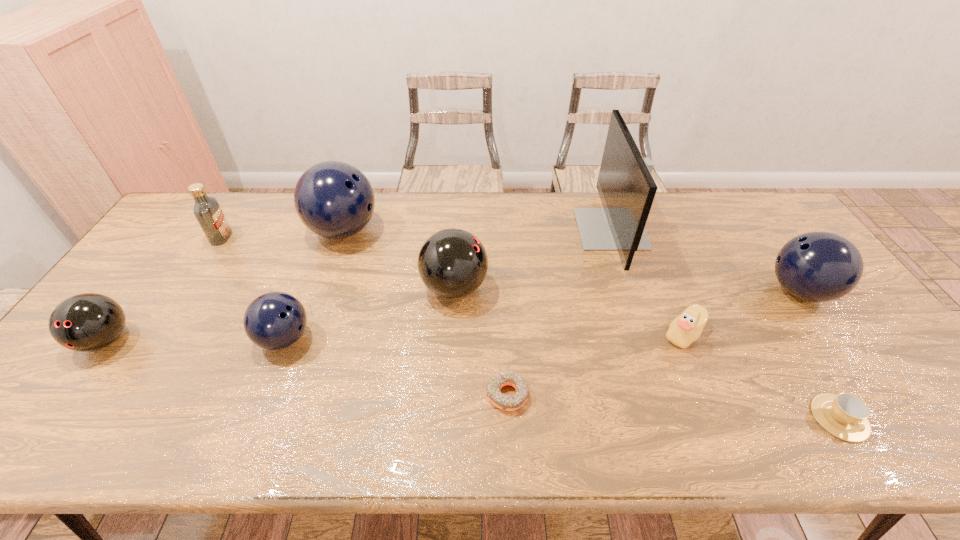
The image size is (960, 540). Find the location of `empty space between the vodka and the second nearest blue bowling ball`. empty space between the vodka and the second nearest blue bowling ball is located at coordinates (511, 264).

Locate an element on the screen. The width and height of the screenshot is (960, 540). vacant space that is in between the nearest blue bowling ball and the leftmost object is located at coordinates (195, 339).

Locate an element on the screen. Image resolution: width=960 pixels, height=540 pixels. unoccupied position between the beige duck and the fourth bowling ball from left to right is located at coordinates (569, 311).

Locate an element on the screen. This screenshot has width=960, height=540. free space between the fourth bowling ball from left to right and the computer monitor is located at coordinates (533, 259).

Where is `vacant region between the nearer black bowling ball and the shortest object`? The height and width of the screenshot is (540, 960). vacant region between the nearer black bowling ball and the shortest object is located at coordinates (306, 368).

Locate an element on the screen. the second closest object to the second shortest object is located at coordinates (818, 266).

Identify which object is located as the fourth nearest to the ninth shortest object. Please provide its 2D coordinates. Your answer should be formatted as a tuple, i.e. [(x, y)], where the tuple contains the x and y coordinates of a point satisfying the conditions above.

[(86, 322)]

Identify which bowling ball is the fourth nearest to the leftmost object. Please provide its 2D coordinates. Your answer should be formatted as a tuple, i.e. [(x, y)], where the tuple contains the x and y coordinates of a point satisfying the conditions above.

[(818, 266)]

Identify which bowling ball is the fourth nearest to the bigger black bowling ball. Please provide its 2D coordinates. Your answer should be formatted as a tuple, i.e. [(x, y)], where the tuple contains the x and y coordinates of a point satisfying the conditions above.

[(818, 266)]

The image size is (960, 540). I want to click on blue bowling ball that can be found as the closest to the nearest blue bowling ball, so click(333, 199).